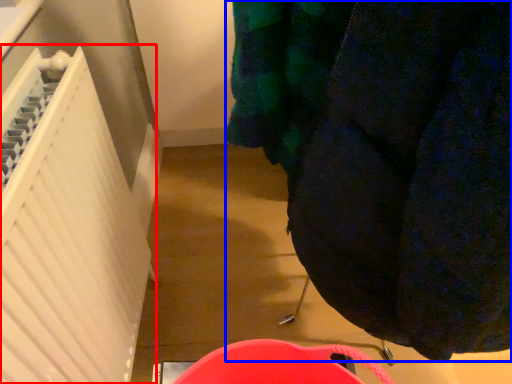
Question: Which point is closer to the camera, radiator (highlighted by a red box) or clothing (highlighted by a blue box)?

Choices:
 (A) radiator
 (B) clothing

Answer: (B)